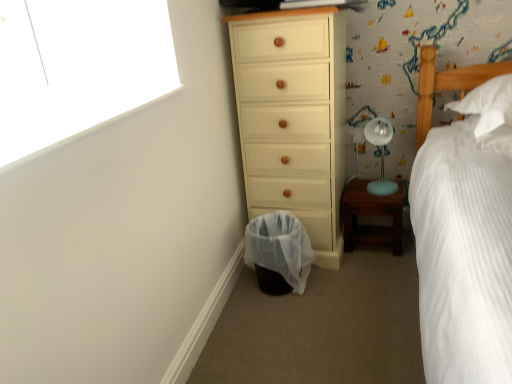
Question: Is wooden nightstand at lower right surrounding white textured bed at right?

Choices:
 (A) no
 (B) yes

Answer: (A)

Question: From a real-world perspective, is wooden nightstand at lower right positioned under white textured bed at right based on gravity?

Choices:
 (A) yes
 (B) no

Answer: (A)

Question: Is wooden nightstand at lower right taller than white textured bed at right?

Choices:
 (A) no
 (B) yes

Answer: (A)

Question: Can you confirm if wooden nightstand at lower right is thinner than white textured bed at right?

Choices:
 (A) yes
 (B) no

Answer: (A)

Question: Is the surface of wooden nightstand at lower right in direct contact with white textured bed at right?

Choices:
 (A) yes
 (B) no

Answer: (B)

Question: Is wooden nightstand at lower right behind white textured bed at right?

Choices:
 (A) yes
 (B) no

Answer: (A)

Question: From a real-world perspective, is matte cream chest of drawers at center on top of translucent plastic laundry basket at lower center?

Choices:
 (A) no
 (B) yes

Answer: (B)

Question: Would you say translucent plastic laundry basket at lower center is part of matte cream chest of drawers at center's contents?

Choices:
 (A) yes
 (B) no

Answer: (B)

Question: Could you tell me if matte cream chest of drawers at center is turned towards translucent plastic laundry basket at lower center?

Choices:
 (A) yes
 (B) no

Answer: (A)

Question: Does matte cream chest of drawers at center have a smaller size compared to translucent plastic laundry basket at lower center?

Choices:
 (A) no
 (B) yes

Answer: (A)

Question: Considering the relative sizes of matte cream chest of drawers at center and translucent plastic laundry basket at lower center in the image provided, is matte cream chest of drawers at center shorter than translucent plastic laundry basket at lower center?

Choices:
 (A) yes
 (B) no

Answer: (B)

Question: Is matte cream chest of drawers at center taller than translucent plastic laundry basket at lower center?

Choices:
 (A) no
 (B) yes

Answer: (B)

Question: Considering the relative sizes of wooden nightstand at lower right and translucent plastic laundry basket at lower center in the image provided, is wooden nightstand at lower right smaller than translucent plastic laundry basket at lower center?

Choices:
 (A) yes
 (B) no

Answer: (A)